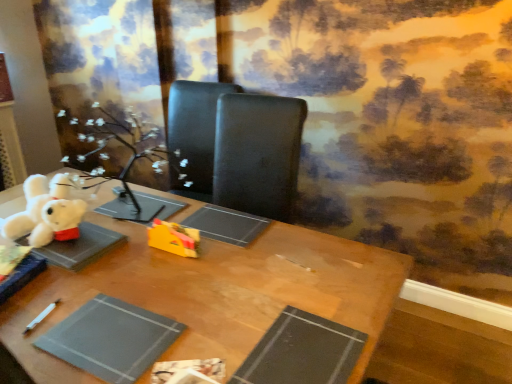
Where is `vacant space in black matte paperback book at lower center, marked as the second paperback book in a left-to-right arrangement (from a real-world perspective)`? vacant space in black matte paperback book at lower center, marked as the second paperback book in a left-to-right arrangement (from a real-world perspective) is located at coordinates (296, 344).